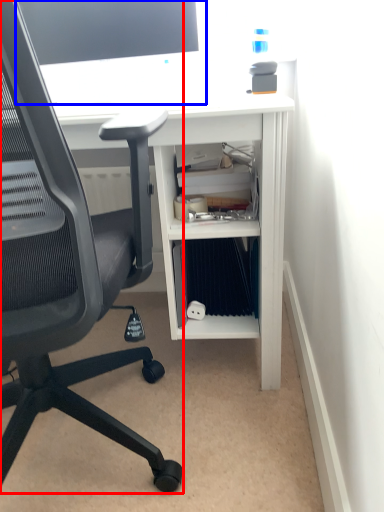
Question: Among these objects, which one is farthest to the camera, chair (highlighted by a red box) or desktop computer (highlighted by a blue box)?

Choices:
 (A) chair
 (B) desktop computer

Answer: (B)